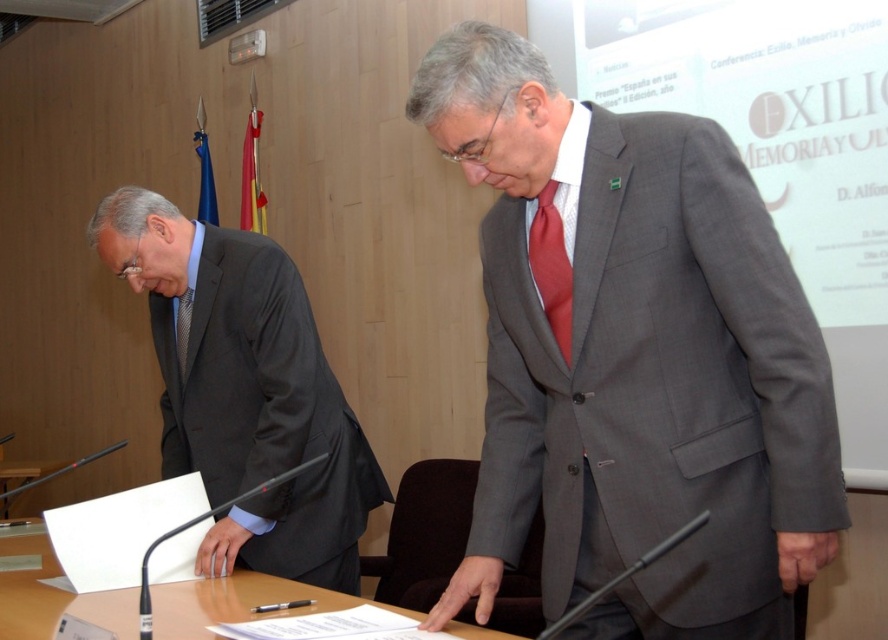
Is the position of matte gray suit at center less distant than that of white paper at center?

Yes, matte gray suit at center is closer to the viewer.

Which is more to the right, matte gray suit at center or white paper at center?

matte gray suit at center is more to the right.

Does point (735, 563) come farther from viewer compared to point (292, 627)?

No, (735, 563) is closer to viewer.

Where is `matte gray suit at center`? Image resolution: width=888 pixels, height=640 pixels. matte gray suit at center is located at coordinates 633,362.

This screenshot has width=888, height=640. What do you see at coordinates (327, 627) in the screenshot?
I see `white paper at center` at bounding box center [327, 627].

Who is higher up, white paper at center or silk textured tie at left?

silk textured tie at left is higher up.

Who is more distant from viewer, (363, 616) or (177, 352)?

Point (177, 352)

Identify the location of white paper at center. Image resolution: width=888 pixels, height=640 pixels. (327, 627).

Find the location of `white paper at lower left`. white paper at lower left is located at coordinates (119, 531).

At what (x,y) coordinates should I click in order to perform the action: click on white paper at lower left. Please return your answer as a coordinate pair (x, y). This screenshot has width=888, height=640. Looking at the image, I should click on (119, 531).